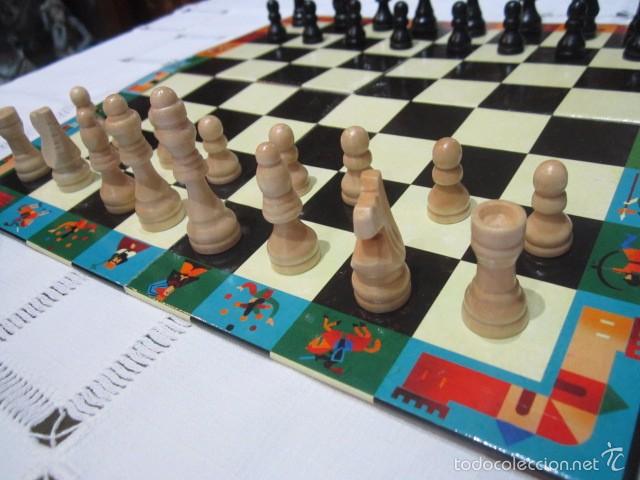
At what (x,y) coordinates should I click in order to perform the action: click on chess board. Please return your answer as a coordinate pair (x, y). Looking at the image, I should click on (394, 107).